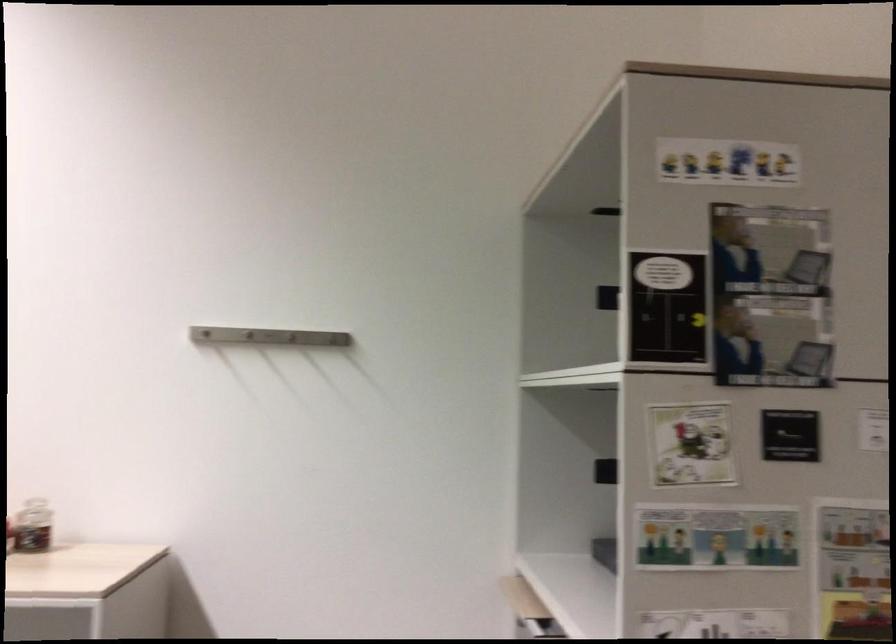
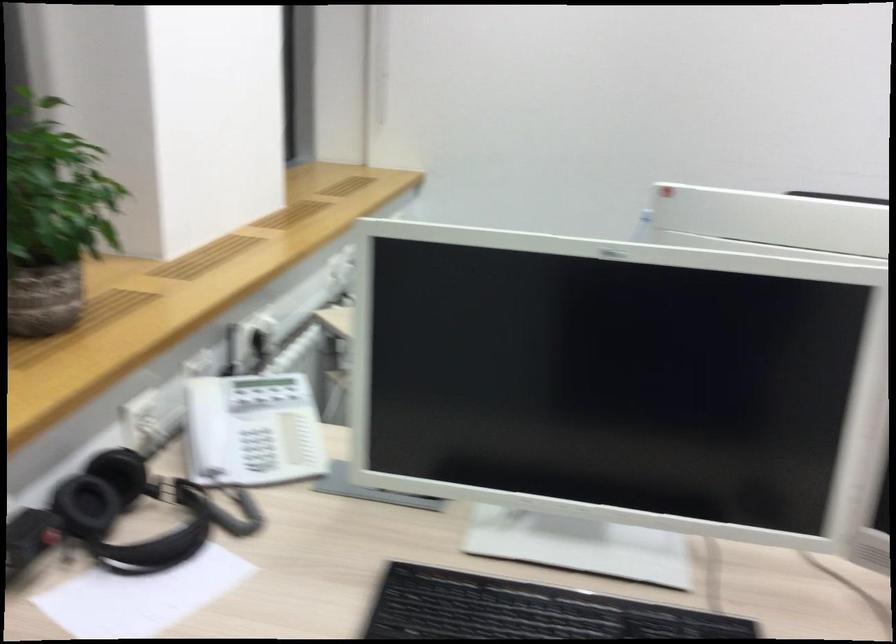
In the scene shown: What movement of the cameraman would produce the second image?

The cameraman walked toward left, backward.